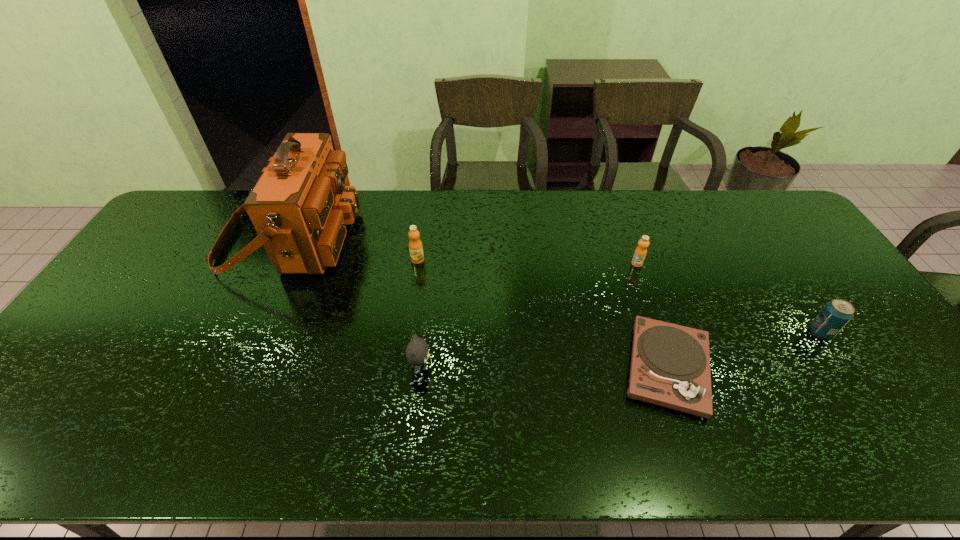
Where is `the leftmost object`? the leftmost object is located at coordinates (299, 207).

You are a GUI agent. You are given a task and a screenshot of the screen. Output one action in this format:
    pyautogui.click(x=<x>, y=<y>)
    Task: Click on the satchel
    
    Given the screenshot: What is the action you would take?
    pyautogui.click(x=299, y=207)

Where is `the left orange juice`? the left orange juice is located at coordinates (415, 245).

Identify the location of the second tallest object. The height and width of the screenshot is (540, 960). (415, 245).

I want to click on the right orange juice, so click(640, 252).

Find the location of `the rightmost object`. the rightmost object is located at coordinates (836, 314).

At what (x,y) coordinates should I click in order to perform the action: click on kitten. Please return your answer as a coordinate pair (x, y). The image size is (960, 540). Looking at the image, I should click on (417, 351).

Where is `phonograph_record`? Image resolution: width=960 pixels, height=540 pixels. phonograph_record is located at coordinates (670, 364).

The image size is (960, 540). I want to click on vacant region located on the face side of the tallest object, so click(382, 239).

This screenshot has width=960, height=540. I want to click on free space located on the front label of the left orange juice, so click(x=407, y=335).